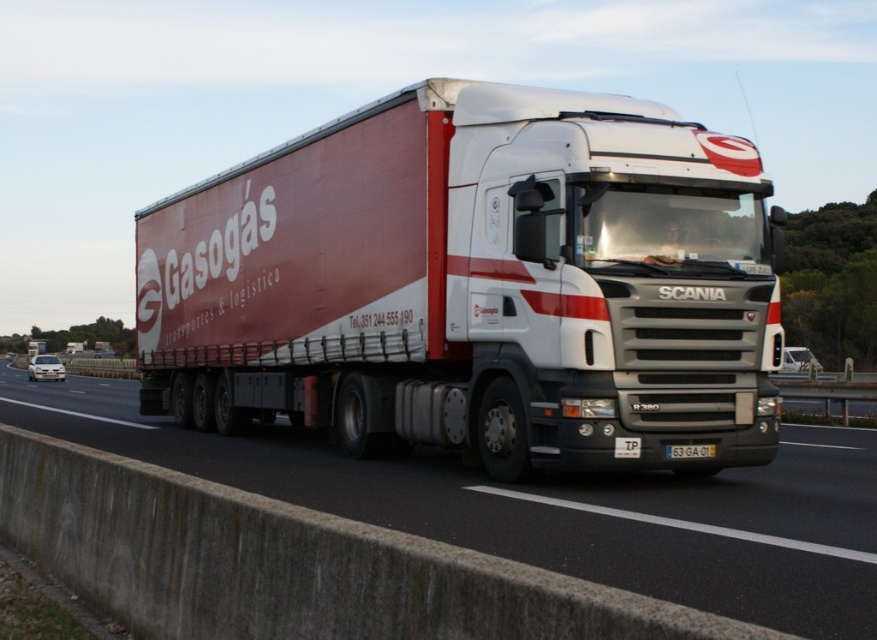
Which of these two, white glossy truck at center or white plastic license plate at center, stands taller?

white glossy truck at center

Locate an element on the screen. The image size is (877, 640). white glossy truck at center is located at coordinates (551, 506).

Can you confirm if matte white trailer truck at center is wider than yellow plastic license plate at center?

Yes, matte white trailer truck at center is wider than yellow plastic license plate at center.

Who is taller, matte white trailer truck at center or yellow plastic license plate at center?

With more height is matte white trailer truck at center.

Locate an element on the screen. The width and height of the screenshot is (877, 640). matte white trailer truck at center is located at coordinates (476, 284).

Who is lower down, white plastic license plate at center or yellow plastic license plate at center?

Positioned lower is white plastic license plate at center.

Between white plastic license plate at center and yellow plastic license plate at center, which one is positioned higher?

Positioned higher is yellow plastic license plate at center.

From the picture: Measure the distance between point (701, 448) and camera.

Point (701, 448) is 8.74 meters away from camera.

I want to click on white plastic license plate at center, so click(690, 451).